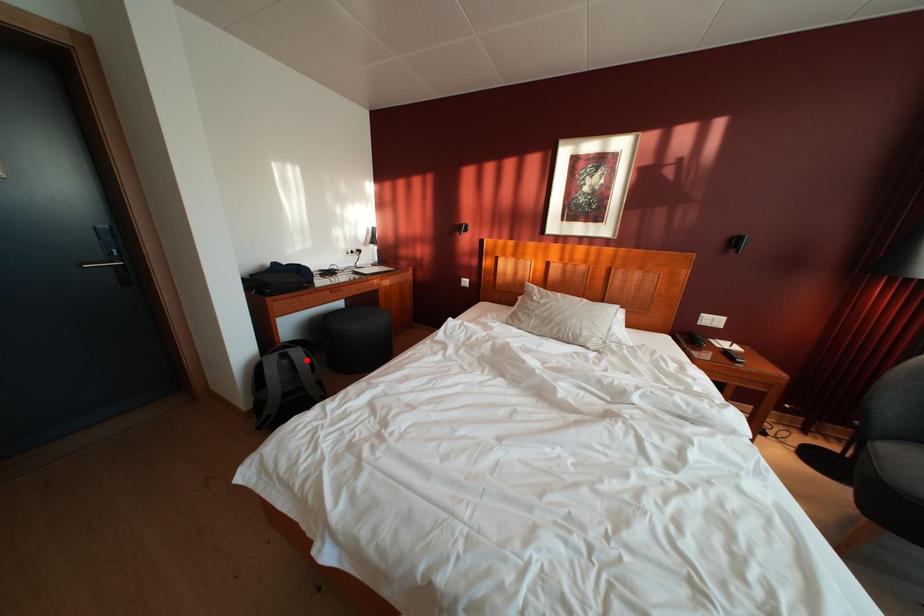
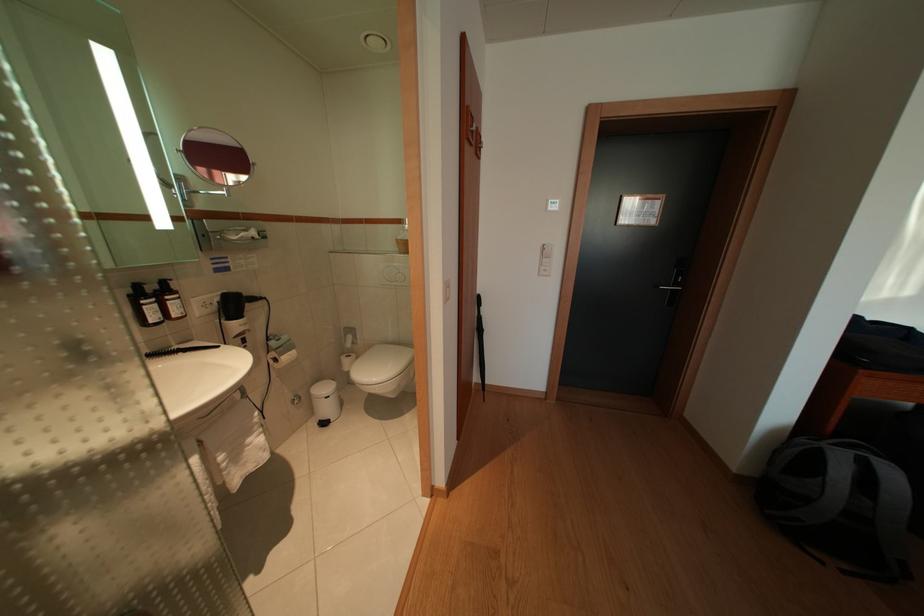
Question: A red point is marked in image1. In image2, is the corresponding 3D point closer to the camera or farther? Reply with the corresponding letter.

Choices:
 (A) The corresponding 3D point is closer.
 (B) The corresponding 3D point is farther.

Answer: (B)